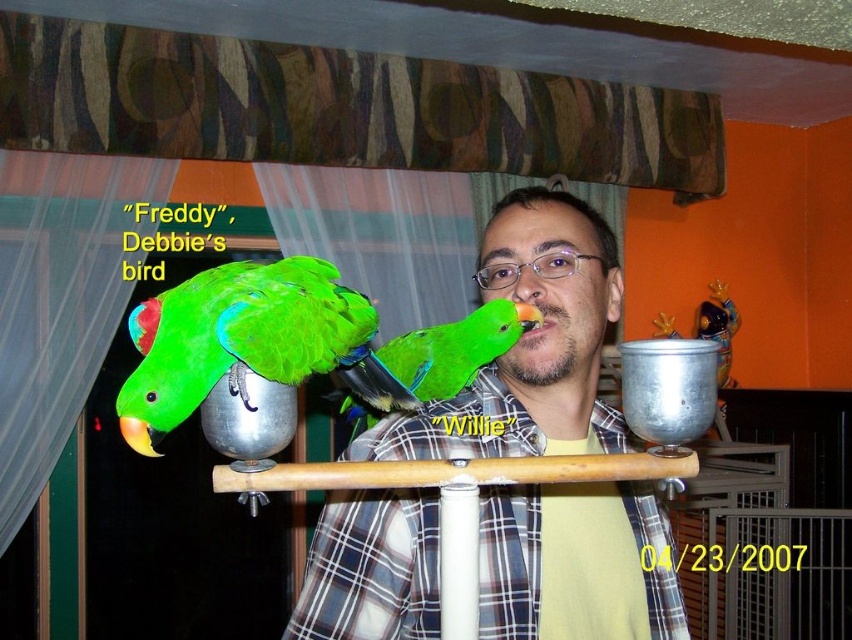
You are a visitor in the room and want to take a photo of the matte green parrot at center without the green matte parrot at left appearing in the frame. Is this possible given their positions?

The matte green parrot at center is positioned under the green matte parrot at left, so if you angle the camera downward to focus on the lower position of the matte green parrot at center, the green matte parrot at left above it would not be in the frame.

You are a photographer setting up for a photo shoot. You need to position a light source so that it illuminates both the green matte parrot at left and the green matte parrot at center without casting shadows between them. Based on their positions, where should you place the light source relative to the two parrots?

The green matte parrot at left is in front of the green matte parrot at center. To avoid casting shadows between them, the light source should be placed behind the green matte parrot at left so that both parrots are illuminated and the shadow of the front parrot does not block the light reaching the one behind.